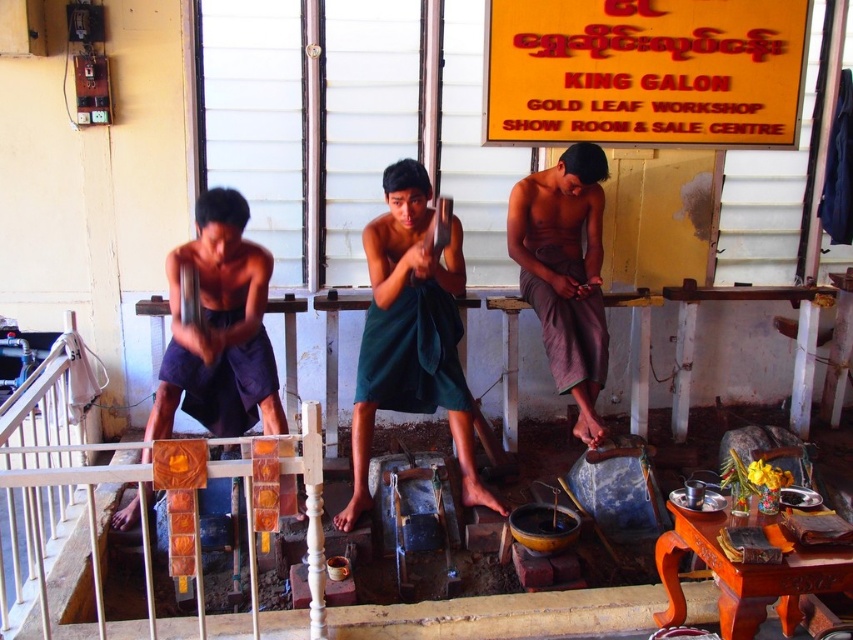
Question: Is green fabric at center to the right of dark blue fabric at left from the viewer's perspective?

Choices:
 (A) no
 (B) yes

Answer: (B)

Question: Which point is farther to the camera?

Choices:
 (A) (372, 221)
 (B) (521, 182)

Answer: (B)

Question: Estimate the real-world distances between objects in this image. Which object is farther from the green fabric at center?

Choices:
 (A) gray cotton pants at center
 (B) dark blue fabric at left

Answer: (A)

Question: Can you confirm if green fabric at center is positioned to the left of gray cotton pants at center?

Choices:
 (A) no
 (B) yes

Answer: (B)

Question: Does green fabric at center appear on the right side of dark blue fabric at left?

Choices:
 (A) no
 (B) yes

Answer: (B)

Question: Estimate the real-world distances between objects in this image. Which object is farther from the dark blue fabric at left?

Choices:
 (A) gray cotton pants at center
 (B) green fabric at center

Answer: (A)